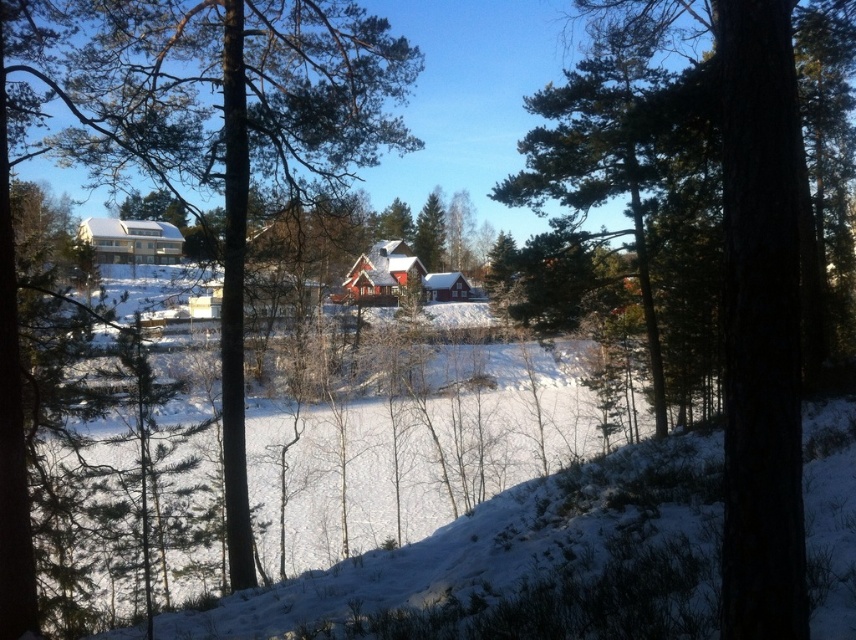
Is white matte cabin at center closer to camera compared to white wooden cabin at center?

Yes, white matte cabin at center is closer to the viewer.

Between white matte cabin at center and white wooden cabin at center, which one appears on the right side from the viewer's perspective?

From the viewer's perspective, white wooden cabin at center appears more on the right side.

Identify the location of white matte cabin at center. (131, 241).

Is green textured tree at center closer to the viewer compared to red wooden cabin at center?

Yes, green textured tree at center is closer to the viewer.

In the scene shown: Does green textured tree at center appear on the right side of red wooden cabin at center?

Correct, you'll find green textured tree at center to the right of red wooden cabin at center.

The height and width of the screenshot is (640, 856). In order to click on green textured tree at center in this screenshot , I will do `click(755, 310)`.

You are a GUI agent. You are given a task and a screenshot of the screen. Output one action in this format:
    pyautogui.click(x=<x>, y=<y>)
    Task: Click on the green textured tree at center
    The width and height of the screenshot is (856, 640).
    Given the screenshot: What is the action you would take?
    pyautogui.click(x=755, y=310)

Who is positioned more to the left, green textured tree at center or white matte cabin at center?

Positioned to the left is white matte cabin at center.

Locate an element on the screen. This screenshot has height=640, width=856. green textured tree at center is located at coordinates (755, 310).